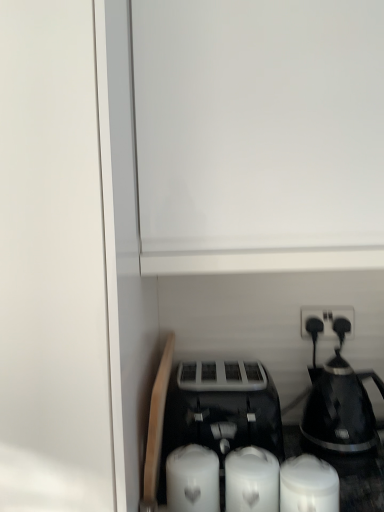
Question: Is white matte candle at lower center, which is the 1th candle from left to right, smaller than black plastic electric outlet at upper right?

Choices:
 (A) yes
 (B) no

Answer: (B)

Question: From the image's perspective, is white matte candle at lower center, placed as the third candle when sorted from right to left, located beneath black plastic electric outlet at upper right?

Choices:
 (A) no
 (B) yes

Answer: (B)

Question: Does white matte candle at lower center, placed as the third candle when sorted from right to left, have a lesser height compared to black plastic electric outlet at upper right?

Choices:
 (A) yes
 (B) no

Answer: (B)

Question: Is black plastic electric outlet at upper right located within white matte candle at lower center, which is the 1th candle from left to right?

Choices:
 (A) no
 (B) yes

Answer: (A)

Question: Is white matte candle at lower center, which is the 1th candle from left to right, wider than black plastic electric outlet at upper right?

Choices:
 (A) no
 (B) yes

Answer: (B)

Question: Is point (165, 485) closer or farther from the camera than point (309, 503)?

Choices:
 (A) closer
 (B) farther

Answer: (B)

Question: Relative to white matte candle at lower right, which ranks as the third candle in left-to-right order, is white matte candle at lower center, placed as the third candle when sorted from right to left, in front or behind?

Choices:
 (A) behind
 (B) front

Answer: (A)

Question: From the image's perspective, is white matte candle at lower center, which is the 1th candle from left to right, positioned above or below white matte candle at lower right, which ranks as the third candle in left-to-right order?

Choices:
 (A) below
 (B) above

Answer: (A)

Question: Is white matte candle at lower center, placed as the third candle when sorted from right to left, inside or outside of white matte candle at lower right, marked as the 1th candle in a right-to-left arrangement?

Choices:
 (A) outside
 (B) inside

Answer: (A)

Question: Is black glossy coffee maker at right bigger or smaller than white matte candle at lower right, marked as the 1th candle in a right-to-left arrangement?

Choices:
 (A) big
 (B) small

Answer: (A)

Question: In terms of height, does black glossy coffee maker at right look taller or shorter compared to white matte candle at lower right, marked as the 1th candle in a right-to-left arrangement?

Choices:
 (A) tall
 (B) short

Answer: (A)

Question: From a real-world perspective, is black glossy coffee maker at right physically located above or below white matte candle at lower right, which ranks as the third candle in left-to-right order?

Choices:
 (A) below
 (B) above

Answer: (B)

Question: Is black glossy coffee maker at right situated inside white matte candle at lower right, marked as the 1th candle in a right-to-left arrangement, or outside?

Choices:
 (A) outside
 (B) inside

Answer: (A)

Question: From the image's perspective, is black plastic toaster at center above or below white matte candle at lower center, which is the 1th candle from left to right?

Choices:
 (A) above
 (B) below

Answer: (A)

Question: Relative to white matte candle at lower center, placed as the third candle when sorted from right to left, is black plastic toaster at center in front or behind?

Choices:
 (A) behind
 (B) front

Answer: (A)